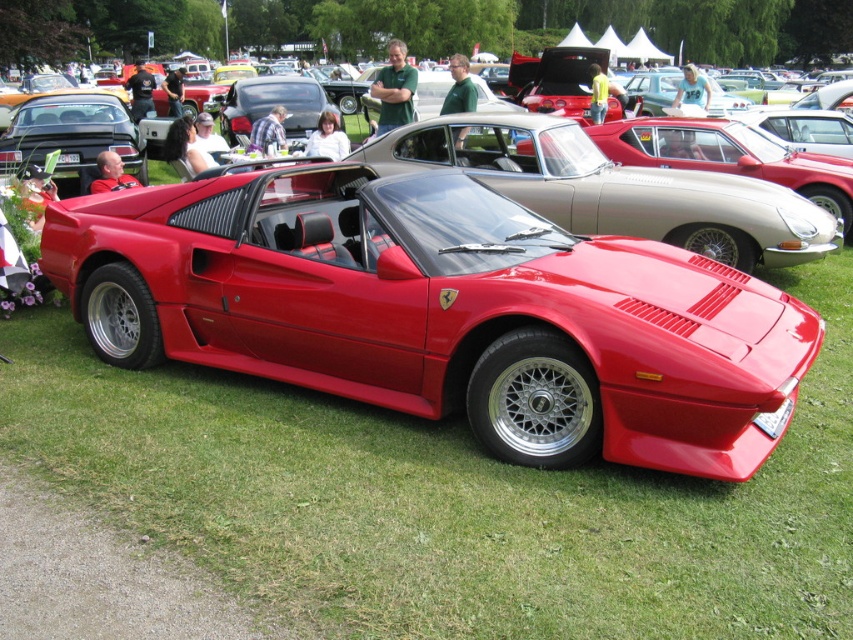
You are a photographer at the car show and need to decide which car to shoot first. The shiny red sports car at center and the metallic silver convertible at center are both in your view. Which car is taller?

The shiny red sports car at center is much taller than the metallic silver convertible at center, so you should choose the shiny red sports car at center first if you want to capture the taller vehicle.

In the scene shown: You are attending a car show and want to take a photo of both the shiny red sports car at center and the metallic silver convertible at center. Which car should you focus on first to ensure both are in the frame?

You should focus on the shiny red sports car at center first because it is positioned under the metallic silver convertible at center, so capturing it first ensures both are in the frame.